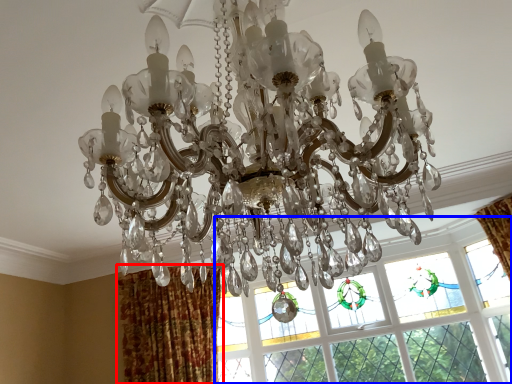
Question: Which of the following is the closest to the observer, curtain (highlighted by a red box) or window (highlighted by a blue box)?

Choices:
 (A) curtain
 (B) window

Answer: (A)